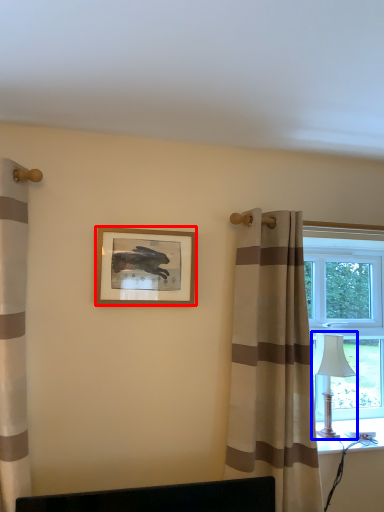
Question: Which of the following is the farthest to the observer, picture frame (highlighted by a red box) or table lamp (highlighted by a blue box)?

Choices:
 (A) picture frame
 (B) table lamp

Answer: (B)